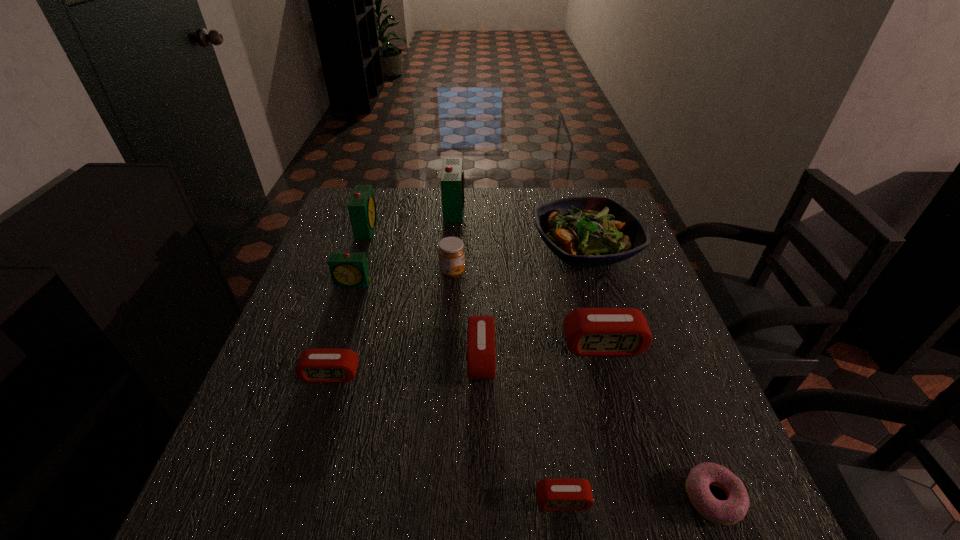
Identify the location of blank space located 0.140m on the front label of the jam. The image size is (960, 540). (518, 273).

In order to click on vacant region located on the front-facing side of the smallest green alarm clock in this screenshot , I will do `click(314, 404)`.

Locate an element on the screen. The width and height of the screenshot is (960, 540). vacant space positioned on the front-facing side of the rightmost alarm clock is located at coordinates (650, 520).

Locate an element on the screen. vacant area situated 0.100m on the front-facing side of the sixth object from left to right is located at coordinates (422, 357).

Locate an element on the screen. vacant space located on the front-facing side of the sixth object from left to right is located at coordinates (335, 357).

Identify the location of blank space located on the front-facing side of the sixth object from left to right. The image size is (960, 540). (395, 357).

Locate an element on the screen. free spot located 0.160m on the front-facing side of the second smallest pink alarm clock is located at coordinates (304, 458).

Locate an element on the screen. This screenshot has height=540, width=960. vacant space situated 0.300m on the left of the pink doughnut is located at coordinates (506, 497).

The height and width of the screenshot is (540, 960). I want to click on salad plate that is at the far edge, so click(587, 231).

Locate an element on the screen. The image size is (960, 540). alarm clock that is at the near edge is located at coordinates (552, 494).